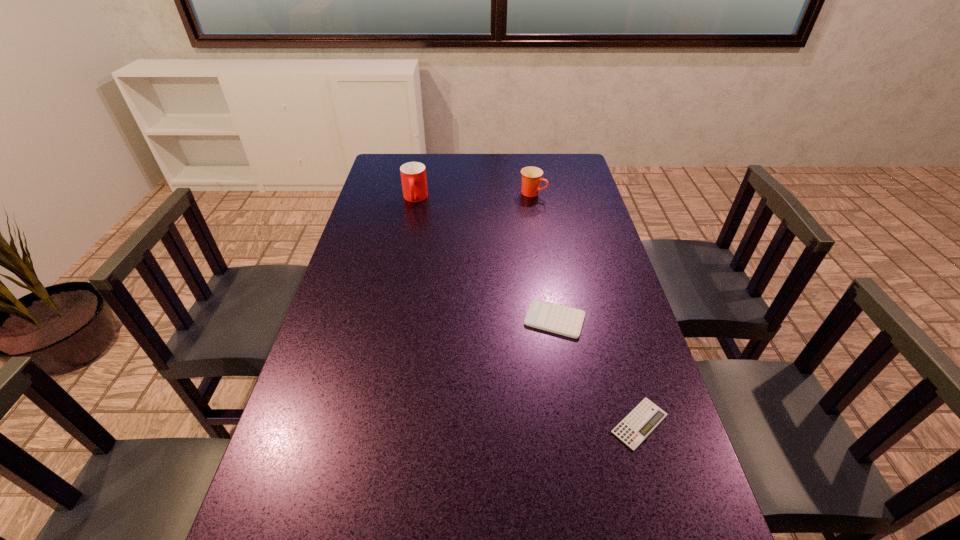
Identify the location of the taller cup. The width and height of the screenshot is (960, 540). (413, 174).

Identify the location of the tallest object. Image resolution: width=960 pixels, height=540 pixels. (413, 174).

This screenshot has width=960, height=540. Identify the location of the shorter cup. (531, 176).

You are a GUI agent. You are given a task and a screenshot of the screen. Output one action in this format:
    pyautogui.click(x=<x>, y=<y>)
    Task: Click on the third shortest object
    This screenshot has height=540, width=960.
    Given the screenshot: What is the action you would take?
    pyautogui.click(x=531, y=176)

At what (x,y) coordinates should I click in order to perform the action: click on the second nearest object. Please return your answer as a coordinate pair (x, y). Looking at the image, I should click on (555, 318).

I want to click on the third tallest object, so click(555, 318).

This screenshot has width=960, height=540. What are the coordinates of `the shortest object` in the screenshot? It's located at (646, 416).

This screenshot has height=540, width=960. What are the coordinates of `the nearest object` in the screenshot? It's located at (646, 416).

Identify the location of vacant point located 0.250m on the side of the left cup with the handle. The height and width of the screenshot is (540, 960). (405, 251).

The width and height of the screenshot is (960, 540). What are the coordinates of `vacant space located on the right of the third shortest object` in the screenshot? It's located at (577, 193).